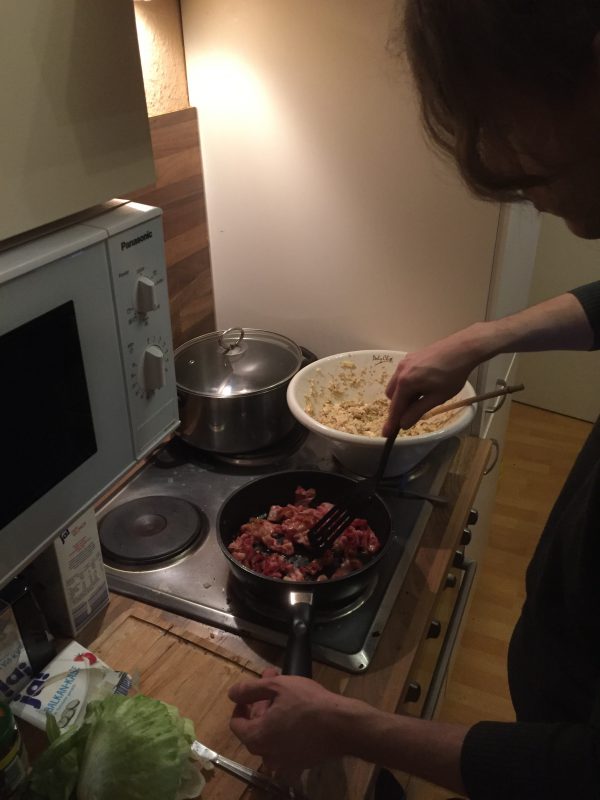
I want to click on metal silver knife, so point(249,772).